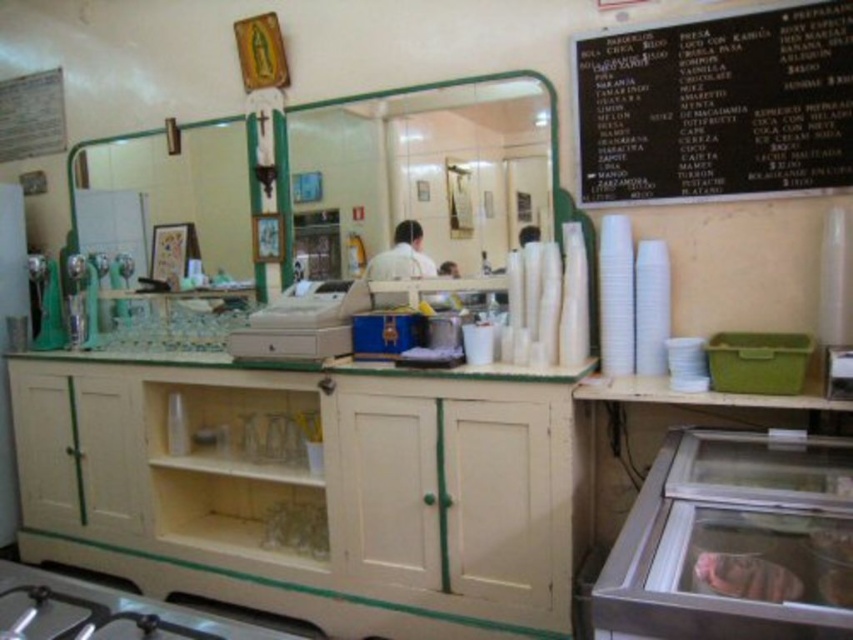
You are a customer at the eatery and want to see both the black chalkboard at upper right and the transparent glass display case at lower right. Which one can you see more of in terms of size?

The transparent glass display case at lower right is larger than the black chalkboard at upper right, so you can see more of it in terms of size.